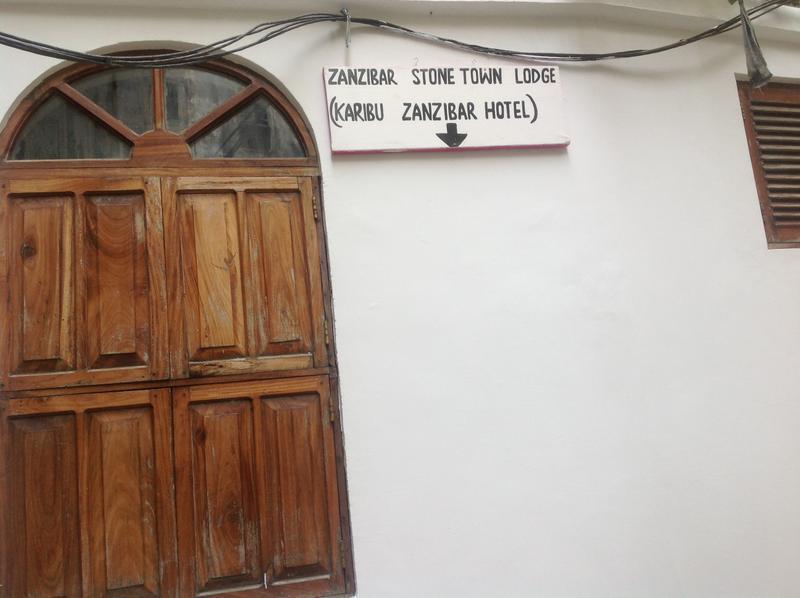
Find the location of `silver hanging stud on white wall`. silver hanging stud on white wall is located at coordinates (346, 16).